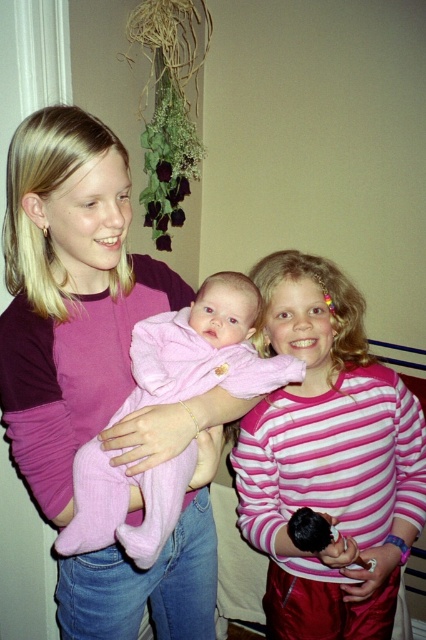
Question: Does pink striped shirt at center appear on the right side of pink soft fabric baby at center?

Choices:
 (A) no
 (B) yes

Answer: (B)

Question: Which point appears farthest from the camera in this image?

Choices:
 (A) (347, 362)
 (B) (65, 371)

Answer: (A)

Question: Can you confirm if pink striped shirt at center is positioned above pink soft fabric baby at center?

Choices:
 (A) yes
 (B) no

Answer: (B)

Question: Is pink fabric baby at left behind pink soft fabric baby at center?

Choices:
 (A) no
 (B) yes

Answer: (B)

Question: Which object is the closest to the pink soft fabric baby at center?

Choices:
 (A) pink fabric baby at left
 (B) pink striped shirt at center

Answer: (A)

Question: Estimate the real-world distances between objects in this image. Which object is farther from the pink soft fabric baby at center?

Choices:
 (A) pink striped shirt at center
 (B) pink fabric baby at left

Answer: (A)